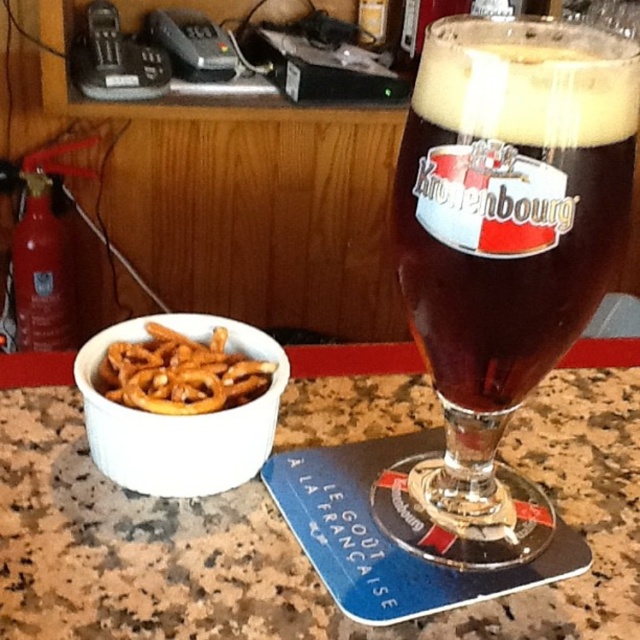
Is white ceramic bowl at left smaller than golden crispy pretzels at lower left?

No, white ceramic bowl at left is not smaller than golden crispy pretzels at lower left.

Describe the element at coordinates (180, 419) in the screenshot. I see `white ceramic bowl at left` at that location.

Measure the distance between white ceramic bowl at left and camera.

white ceramic bowl at left is 30.53 centimeters from camera.

Where is `white ceramic bowl at left`? white ceramic bowl at left is located at coordinates (180, 419).

Does dark brown glass at center have a smaller size compared to golden crispy pretzels at lower left?

No, dark brown glass at center is not smaller than golden crispy pretzels at lower left.

Who is positioned more to the right, dark brown glass at center or golden crispy pretzels at lower left?

Positioned to the right is dark brown glass at center.

Where is `dark brown glass at center`? This screenshot has width=640, height=640. dark brown glass at center is located at coordinates (512, 196).

Between granite countertop at center and white ceramic bowl at left, which one has more height?

With more height is granite countertop at center.

Between granite countertop at center and white ceramic bowl at left, which one has less height?

white ceramic bowl at left

The width and height of the screenshot is (640, 640). I want to click on granite countertop at center, so click(x=291, y=536).

I want to click on granite countertop at center, so click(291, 536).